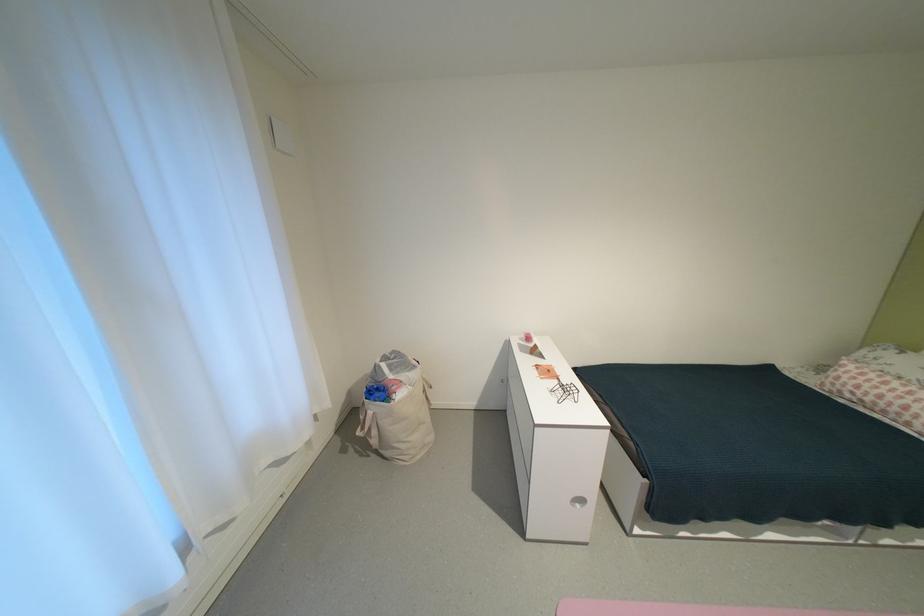
The height and width of the screenshot is (616, 924). I want to click on white drawer handle, so click(x=578, y=501).